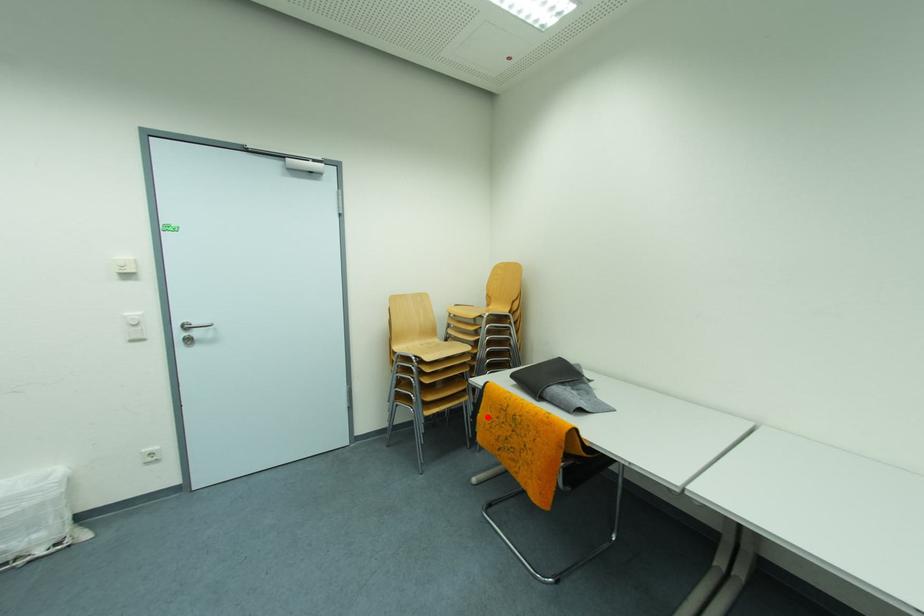
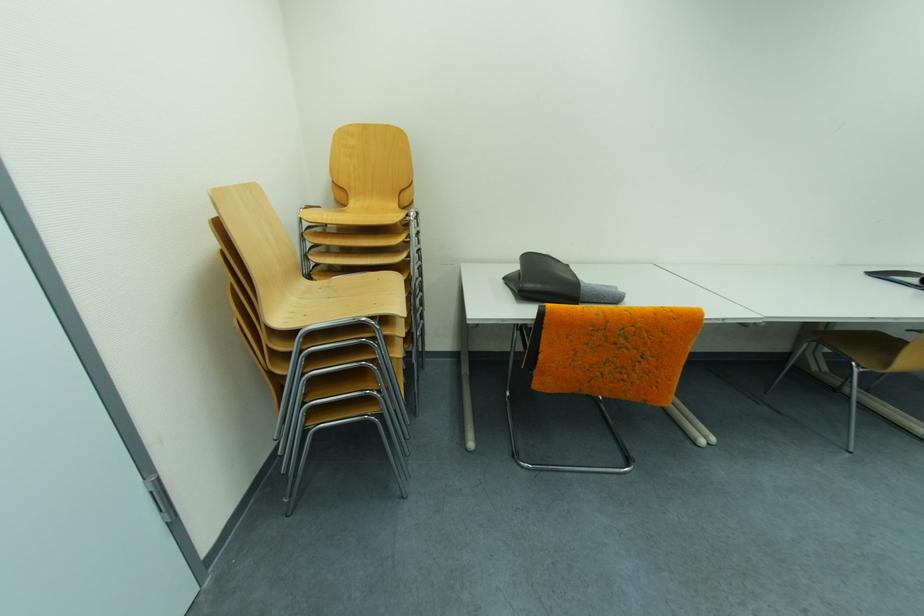
Question: I am providing you with two images of the same scene from different viewpoints. Image1 has a red point marked. In image2, the corresponding 3D location appears at what relative position? Reply with the corresponding letter.

Choices:
 (A) Closer
 (B) Farther

Answer: (A)